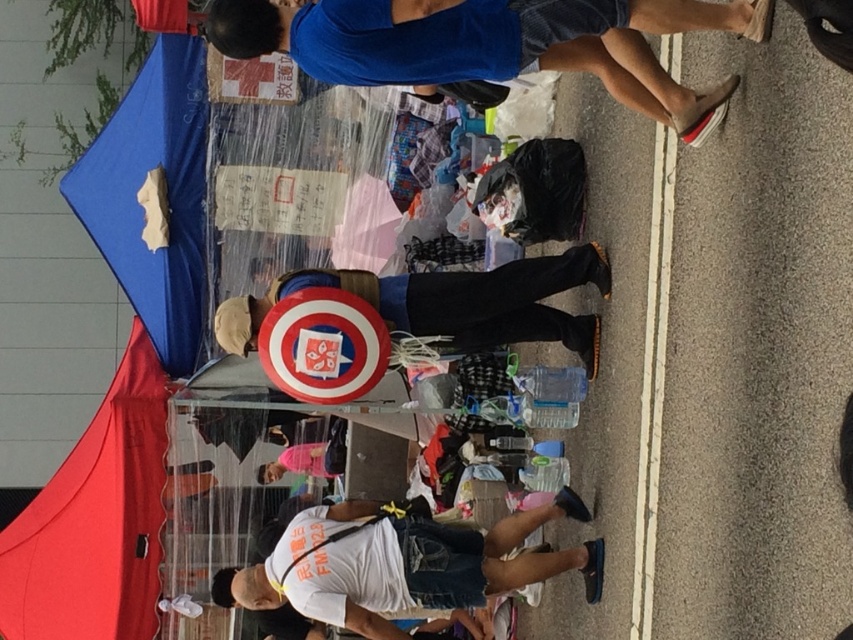
Question: Which point is farther to the camera?

Choices:
 (A) blue cotton shirt at upper center
 (B) red fabric canopy at lower left
 (C) white cotton t-shirt at lower center
 (D) captain america shield at center

Answer: (B)

Question: Is red fabric canopy at lower left positioned before captain america shield at center?

Choices:
 (A) no
 (B) yes

Answer: (A)

Question: Is red fabric canopy at lower left above captain america shield at center?

Choices:
 (A) yes
 (B) no

Answer: (B)

Question: Is blue cotton shirt at upper center wider than red fabric canopy at lower left?

Choices:
 (A) no
 (B) yes

Answer: (B)

Question: Among these points, which one is nearest to the camera?

Choices:
 (A) (421, 321)
 (B) (341, 508)
 (C) (136, 561)

Answer: (A)

Question: Among these objects, which one is farthest from the camera?

Choices:
 (A) red fabric canopy at lower left
 (B) white cotton t-shirt at lower center
 (C) captain america shield at center

Answer: (A)